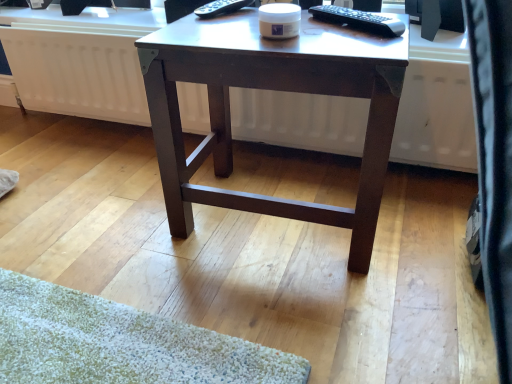
Where is `free space in front of dark brown wood desk at center`? This screenshot has width=512, height=384. free space in front of dark brown wood desk at center is located at coordinates (286, 315).